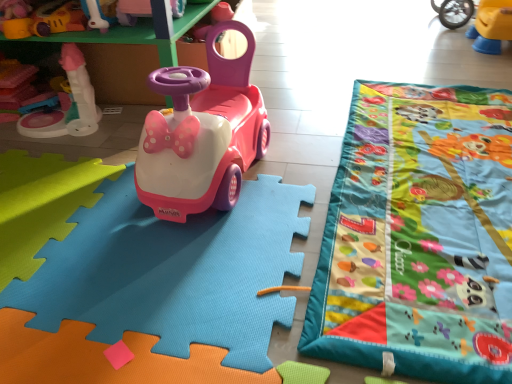
The height and width of the screenshot is (384, 512). I want to click on vacant location below matte plastic toy at left, placed as the 2th toy when sorted from bottom to top (from a real-world perspective), so click(61, 117).